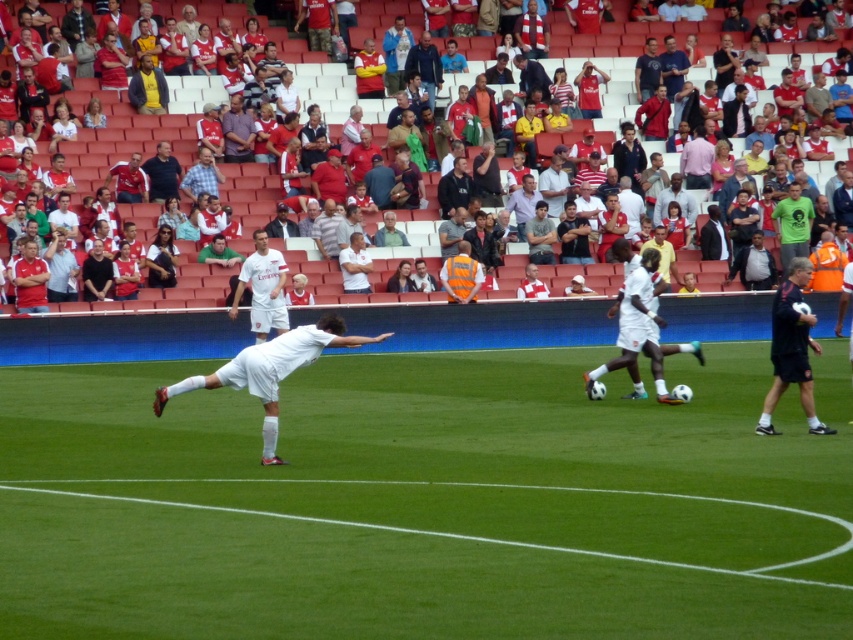
Is point (312, 86) positioned behind point (165, 140)?

Yes, point (312, 86) is behind point (165, 140).

Is point (374, 106) positioned after point (175, 182)?

Yes, point (374, 106) is farther from viewer.

Where is `white fabric crowd at upper center`? Image resolution: width=853 pixels, height=640 pixels. white fabric crowd at upper center is located at coordinates (120, 134).

Who is more distant from viewer, (251, 388) or (229, 141)?

The point (229, 141) is behind.

Is point (263, 365) positioned behind point (236, 129)?

No, it is not.

Is point (274, 339) positioned in front of point (239, 160)?

Yes, point (274, 339) is closer to viewer.

At what (x,y) coordinates should I click in order to perform the action: click on white matte soccer player at center. Please return your answer as a coordinate pair (x, y). Looking at the image, I should click on (270, 371).

Can you confirm if green grass field at center is shorter than white fabric crowd at upper center?

Indeed, green grass field at center has a lesser height compared to white fabric crowd at upper center.

Which is above, green grass field at center or white fabric crowd at upper center?

white fabric crowd at upper center is above.

The image size is (853, 640). What do you see at coordinates (421, 504) in the screenshot?
I see `green grass field at center` at bounding box center [421, 504].

Where is `green grass field at center`? green grass field at center is located at coordinates pos(421,504).